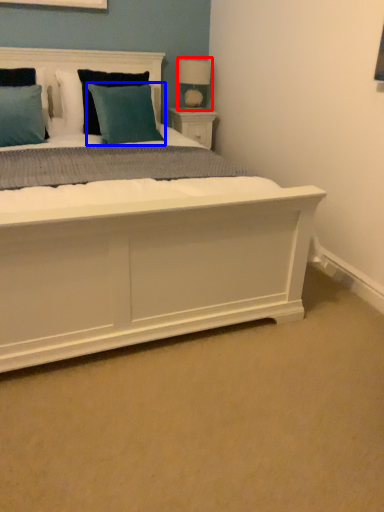
Question: Which point is further to the camera, table lamp (highlighted by a red box) or pillow (highlighted by a blue box)?

Choices:
 (A) table lamp
 (B) pillow

Answer: (A)